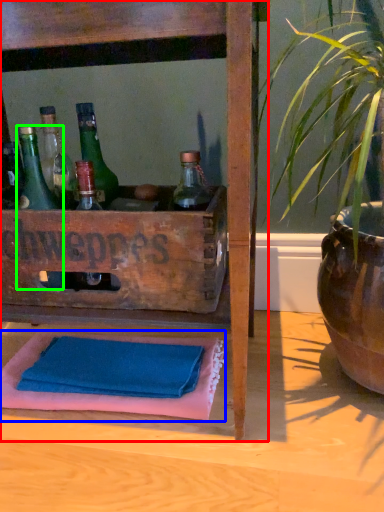
Question: Which object is the farthest from furniture (highlighted by a red box)? Choose among these: bath towel (highlighted by a blue box) or bottle (highlighted by a green box).

Choices:
 (A) bath towel
 (B) bottle

Answer: (A)